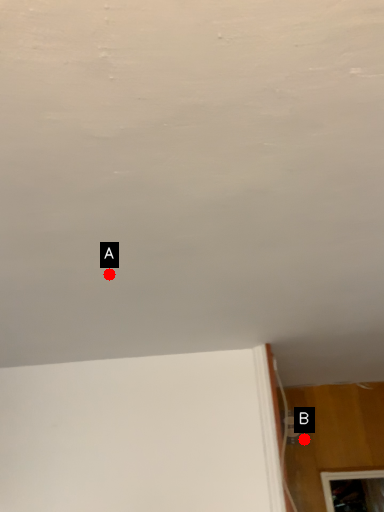
Question: Two points are circled on the image, labeled by A and B beside each circle. Which point is further to the camera?

Choices:
 (A) A is further
 (B) B is further

Answer: (B)